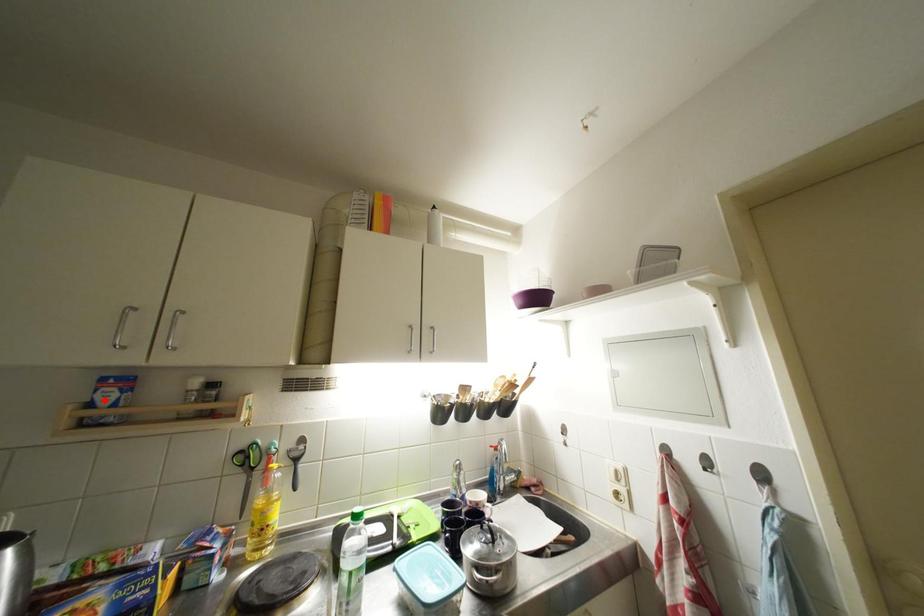
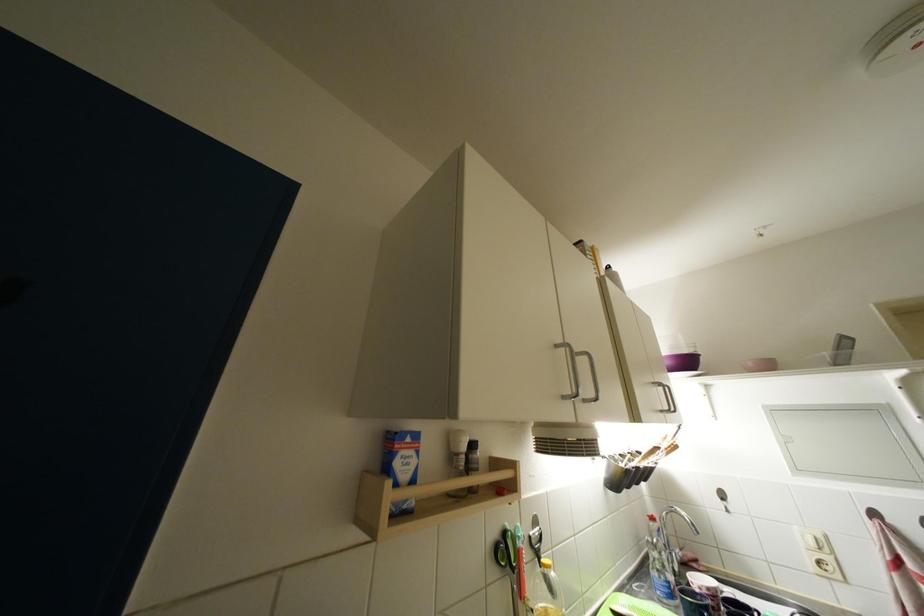
In the second image, find the point that corresponds to the highlighted location in the first image.

(404, 467)